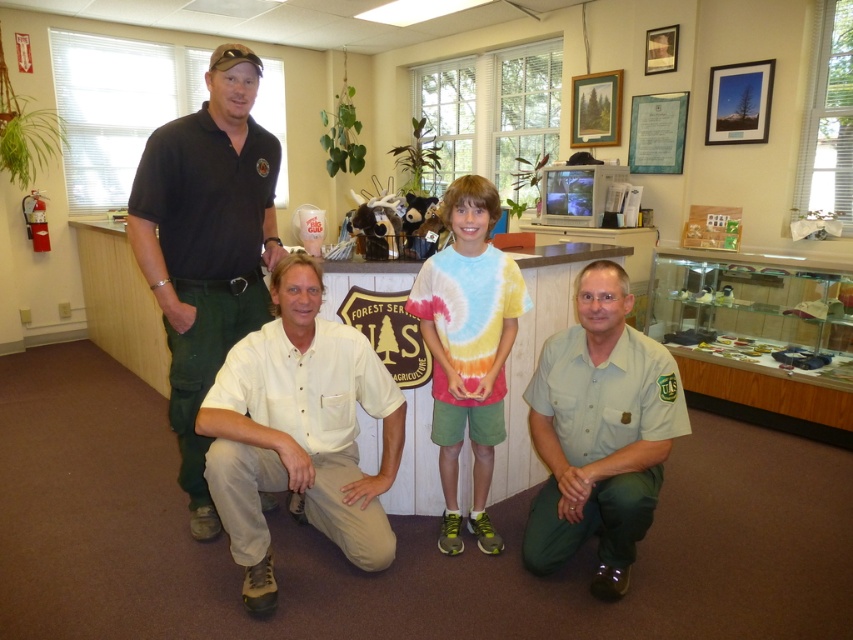
This screenshot has width=853, height=640. Describe the element at coordinates (607, 440) in the screenshot. I see `white cotton shirt at center` at that location.

Which of these two, white cotton shirt at center or black uniform at upper left, stands shorter?

white cotton shirt at center is shorter.

Which is in front, point (473, 486) or point (177, 317)?

Point (177, 317)

Locate an element on the screen. white cotton shirt at center is located at coordinates (607, 440).

From the picture: Is light green uniform at lower right further to the viewer compared to tie-dye fabric shirt at center?

No, light green uniform at lower right is in front of tie-dye fabric shirt at center.

Who is higher up, light green uniform at lower right or tie-dye fabric shirt at center?

Positioned higher is tie-dye fabric shirt at center.

Between point (641, 532) and point (459, 326), which one is positioned behind?

Point (459, 326)

Where is `light green uniform at lower right`? The image size is (853, 640). light green uniform at lower right is located at coordinates (599, 433).

Is beige cotton shirt at center above tie-dye fabric shirt at center?

No, beige cotton shirt at center is not above tie-dye fabric shirt at center.

Between beige cotton shirt at center and tie-dye fabric shirt at center, which one has more height?

tie-dye fabric shirt at center

The width and height of the screenshot is (853, 640). Identify the location of beige cotton shirt at center. (299, 433).

The image size is (853, 640). Find the location of `beige cotton shirt at center`. beige cotton shirt at center is located at coordinates (299, 433).